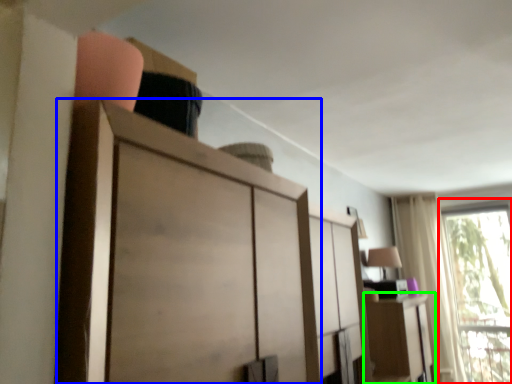
Question: Considering the real-world distances, which object is farthest from window (highlighted by a red box)? cupboard (highlighted by a blue box) or cabinetry (highlighted by a green box)?

Choices:
 (A) cupboard
 (B) cabinetry

Answer: (A)